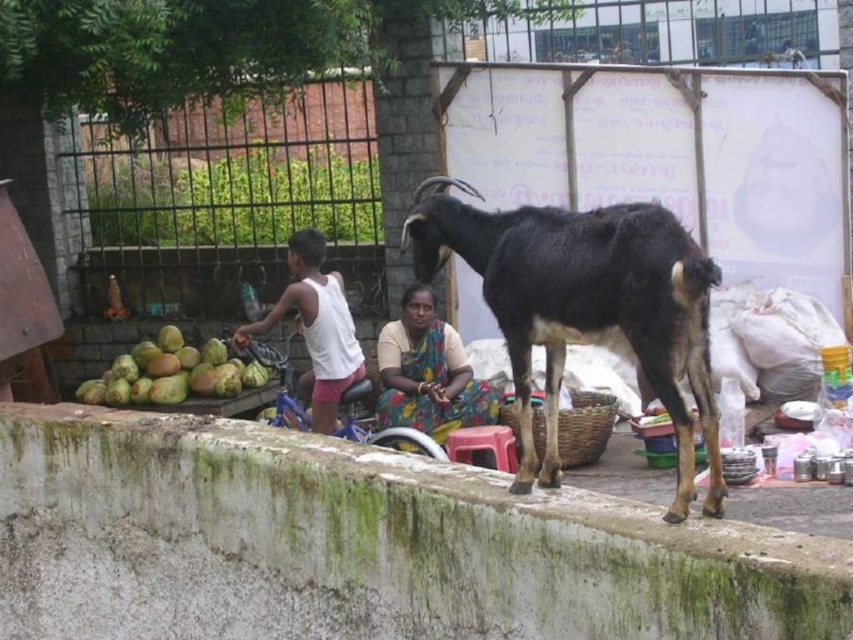
Is point (108, 392) in front of point (508, 461)?

No.

Does green rough coconut at lower left come in front of plastic stool at center?

No, green rough coconut at lower left is further to the viewer.

Is point (111, 387) positioned before point (498, 435)?

No, it is not.

The height and width of the screenshot is (640, 853). I want to click on green rough coconut at lower left, so click(171, 372).

Which is more to the left, black fur goat at center or green rough coconut at lower left?

From the viewer's perspective, green rough coconut at lower left appears more on the left side.

Who is taller, black fur goat at center or green rough coconut at lower left?

Standing taller between the two is black fur goat at center.

What do you see at coordinates (585, 308) in the screenshot?
I see `black fur goat at center` at bounding box center [585, 308].

I want to click on black fur goat at center, so click(585, 308).

Which is behind, point (637, 520) or point (315, 330)?

The point (315, 330) is more distant.

Between point (115, 525) and point (318, 381), which one is positioned in front?

Positioned in front is point (115, 525).

You are a GUI agent. You are given a task and a screenshot of the screen. Output one action in this format:
    pyautogui.click(x=<x>, y=<y>)
    Task: Click on the green mossy concrete at lower center
    Image resolution: width=853 pixels, height=640 pixels.
    Given the screenshot: What is the action you would take?
    pyautogui.click(x=363, y=545)